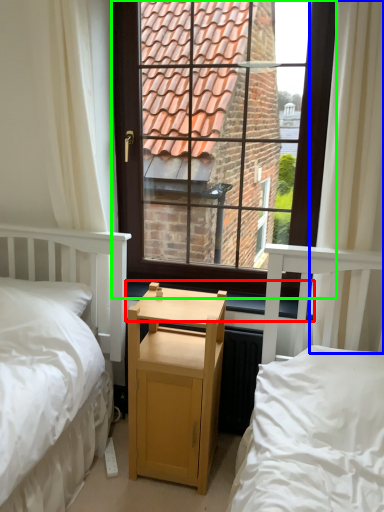
Question: Which object is the farthest from window sill (highlighted by a red box)? Choose among these: curtain (highlighted by a blue box) or window (highlighted by a green box).

Choices:
 (A) curtain
 (B) window

Answer: (B)